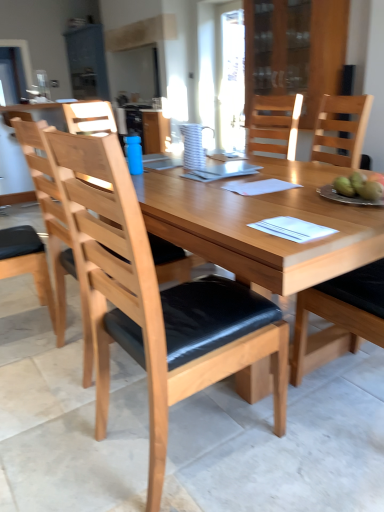
Measure the distance between blue matte bottle at center and camera.

blue matte bottle at center is 7.13 feet from camera.

Locate an element on the screen. This screenshot has height=512, width=384. white striped pitcher at center is located at coordinates (193, 145).

I want to click on light wood/black cushion chair at center, acting as the second chair starting from the right, so click(x=155, y=300).

Find the location of `metallic silver plate at right`. metallic silver plate at right is located at coordinates (347, 197).

In order to face light brown wood chair at center, the third chair from the right, should I rotate leftwards or rightwards?

Turn left by 10.750 degrees to look at light brown wood chair at center, the third chair from the right.

What do you see at coordinates (330, 330) in the screenshot?
I see `natural wood chair at right, which is the third chair from left to right` at bounding box center [330, 330].

At what (x,y) coordinates should I click in order to perform the action: click on natural wood chair at right, positioned as the first chair in right-to-left order. Please return your answer as a coordinate pair (x, y). The image size is (384, 512). Looking at the image, I should click on (330, 330).

This screenshot has width=384, height=512. Identify the location of blue matte bottle at center. (134, 154).

From the image's perspective, is green matte apples at right located beneath natural wood chair at right, which is the third chair from left to right?

No.

Is green matte apples at right in contact with natural wood chair at right, which is the third chair from left to right?

No, green matte apples at right is not making contact with natural wood chair at right, which is the third chair from left to right.

Is green matte apples at right to the left of natural wood chair at right, positioned as the first chair in right-to-left order, from the viewer's perspective?

Yes, green matte apples at right is to the left of natural wood chair at right, positioned as the first chair in right-to-left order.

Can you confirm if green matte apples at right is taller than natural wood chair at right, which is the third chair from left to right?

In fact, green matte apples at right may be shorter than natural wood chair at right, which is the third chair from left to right.

From the picture: Are white striped pitcher at center and natural wood chair at right, which is the third chair from left to right, beside each other?

No, white striped pitcher at center is not making contact with natural wood chair at right, which is the third chair from left to right.

Is white striped pitcher at center situated inside natural wood chair at right, positioned as the first chair in right-to-left order, or outside?

white striped pitcher at center lies outside natural wood chair at right, positioned as the first chair in right-to-left order.

Which object is closer to the camera, white striped pitcher at center or natural wood chair at right, positioned as the first chair in right-to-left order?

Positioned in front is natural wood chair at right, positioned as the first chair in right-to-left order.

Considering the relative positions of natural wood chair at right, positioned as the first chair in right-to-left order, and light brown wood chair at center, the third chair from the right, in the image provided, is natural wood chair at right, positioned as the first chair in right-to-left order, in front of light brown wood chair at center, the third chair from the right,?

Yes, it is.

Is natural wood chair at right, which is the third chair from left to right, located outside light brown wood chair at center, the third chair from the right?

natural wood chair at right, which is the third chair from left to right, is positioned outside light brown wood chair at center, the third chair from the right.

Would you consider natural wood chair at right, positioned as the first chair in right-to-left order, to be distant from light brown wood chair at center, the third chair from the right?

Indeed, natural wood chair at right, positioned as the first chair in right-to-left order, is not near light brown wood chair at center, the third chair from the right.

Between natural wood chair at right, positioned as the first chair in right-to-left order, and light brown wood chair at center, positioned as the 1th chair in left-to-right order, which one has smaller size?

Smaller between the two is natural wood chair at right, positioned as the first chair in right-to-left order.

Is light brown wood chair at center, positioned as the 1th chair in left-to-right order, not inside white striped pitcher at center?

light brown wood chair at center, positioned as the 1th chair in left-to-right order, lies outside white striped pitcher at center's area.

In the scene shown: From a real-world perspective, is light brown wood chair at center, positioned as the 1th chair in left-to-right order, positioned over white striped pitcher at center based on gravity?

Actually, light brown wood chair at center, positioned as the 1th chair in left-to-right order, is physically below white striped pitcher at center in the real world.

Which object is wider, light brown wood chair at center, positioned as the 1th chair in left-to-right order, or white striped pitcher at center?

With larger width is light brown wood chair at center, positioned as the 1th chair in left-to-right order.

From the image's perspective, is white striped pitcher at center beneath metallic silver plate at right?

Actually, white striped pitcher at center appears above metallic silver plate at right in the image.

From a real-world perspective, between white striped pitcher at center and metallic silver plate at right, who is vertically lower?

metallic silver plate at right.

Is white striped pitcher at center inside the boundaries of metallic silver plate at right, or outside?

white striped pitcher at center cannot be found inside metallic silver plate at right.

At what (x,y) coordinates should I click in order to perform the action: click on plate on the right of white striped pitcher at center. Please return your answer as a coordinate pair (x, y). The height and width of the screenshot is (512, 384). Looking at the image, I should click on (347, 197).

Could you tell me if green matte apples at right is turned towards white striped pitcher at center?

Yes, green matte apples at right is turned towards white striped pitcher at center.

Based on the photo, is the surface of green matte apples at right in direct contact with white striped pitcher at center?

green matte apples at right and white striped pitcher at center are clearly separated.

Which is more to the left, green matte apples at right or white striped pitcher at center?

Positioned to the left is white striped pitcher at center.

Considering the positions of points (345, 189) and (183, 133), is point (345, 189) closer to camera compared to point (183, 133)?

Yes.

From a real-world perspective, is blue matte bottle at center located beneath transparent glass cabinet at upper center?

Indeed, from a real-world perspective, blue matte bottle at center is positioned beneath transparent glass cabinet at upper center.

Is point (126, 141) behind point (318, 106)?

No, it is not.

Measure the distance from blue matte bottle at center to transparent glass cabinet at upper center.

blue matte bottle at center and transparent glass cabinet at upper center are 8.96 feet apart from each other.

In the scene shown: Considering the relative sizes of blue matte bottle at center and transparent glass cabinet at upper center in the image provided, is blue matte bottle at center thinner than transparent glass cabinet at upper center?

Correct, the width of blue matte bottle at center is less than that of transparent glass cabinet at upper center.

Identify the location of fruit that appears on the left of natural wood chair at right, which is the third chair from left to right. (359, 186).

At what (x,y) coordinates should I click in order to perform the action: click on chair that is the 2nd object located in front of the white striped pitcher at center. Please return your answer as a coordinate pair (x, y). The image size is (384, 512). Looking at the image, I should click on coord(330,330).

From the image, which object appears to be nearer to transparent glass cabinet at upper center, metallic silver plate at right or natural wood chair at right, which is the third chair from left to right?

natural wood chair at right, which is the third chair from left to right.

Which object lies nearer to the anchor point metallic silver plate at right, light wood/black cushion chair at center, the 2th chair viewed from the left, or light brown wood chair at center, the third chair from the right?

The object closer to metallic silver plate at right is light wood/black cushion chair at center, the 2th chair viewed from the left.

Which object lies further to the anchor point natural wood chair at right, positioned as the first chair in right-to-left order, blue matte bottle at center or light wood/black cushion chair at center, acting as the second chair starting from the right?

Based on the image, light wood/black cushion chair at center, acting as the second chair starting from the right, appears to be further to natural wood chair at right, positioned as the first chair in right-to-left order.

Which object lies further to the anchor point green matte apples at right, light brown wood chair at center, the third chair from the right, or light wood/black cushion chair at center, the 2th chair viewed from the left?

Among the two, light brown wood chair at center, the third chair from the right, is located further to green matte apples at right.

Considering their positions, is white striped pitcher at center positioned closer to transparent glass cabinet at upper center than green matte apples at right?

Among the two, white striped pitcher at center is located nearer to transparent glass cabinet at upper center.

From the image, which object appears to be nearer to light brown wood chair at center, the third chair from the right, green matte apples at right or natural wood chair at right, which is the third chair from left to right?

The object closer to light brown wood chair at center, the third chair from the right, is green matte apples at right.

Based on their spatial positions, is natural wood chair at right, positioned as the first chair in right-to-left order, or light brown wood chair at center, positioned as the 1th chair in left-to-right order, closer to light wood/black cushion chair at center, the 2th chair viewed from the left?

light brown wood chair at center, positioned as the 1th chair in left-to-right order, is positioned closer to the anchor light wood/black cushion chair at center, the 2th chair viewed from the left.

Considering their positions, is natural wood chair at right, positioned as the first chair in right-to-left order, positioned further to blue matte bottle at center than green matte apples at right?

The object further to blue matte bottle at center is natural wood chair at right, positioned as the first chair in right-to-left order.

Find the location of a particular element. Image resolution: width=384 pixels, height=512 pixels. fruit located between natural wood chair at right, positioned as the first chair in right-to-left order, and blue matte bottle at center in the depth direction is located at coordinates (359, 186).

The width and height of the screenshot is (384, 512). What are the coordinates of `plate positioned between natural wood chair at right, positioned as the first chair in right-to-left order, and white striped pitcher at center from near to far` in the screenshot? It's located at (347, 197).

Find the location of a particular element. The width and height of the screenshot is (384, 512). fruit between light wood/black cushion chair at center, acting as the second chair starting from the right, and blue matte bottle at center in the front-back direction is located at coordinates (359, 186).

The height and width of the screenshot is (512, 384). Find the location of `chair between light brown wood chair at center, the third chair from the right, and green matte apples at right from left to right`. chair between light brown wood chair at center, the third chair from the right, and green matte apples at right from left to right is located at coordinates (155, 300).